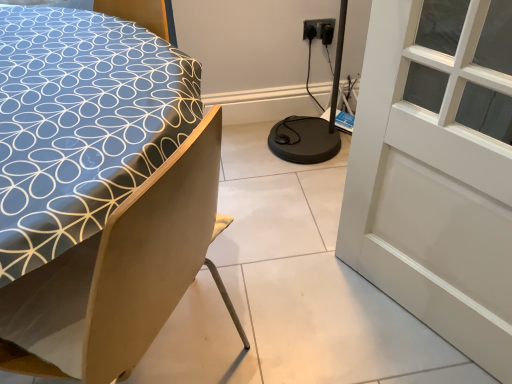
Image resolution: width=512 pixels, height=384 pixels. What are the coordinates of `black plastic electric outlet at upper right` in the screenshot? It's located at (319, 30).

What is the approximate height of blue fabric bed at left?

33.63 inches.

Identify the location of white glass window at upper right. (486, 112).

Is black plastic electric outlet at upper right situated inside white glass window at upper right or outside?

black plastic electric outlet at upper right exists outside the volume of white glass window at upper right.

Between black plastic electric outlet at upper right and white glass window at upper right, which one has smaller size?

With smaller size is black plastic electric outlet at upper right.

Which is more to the right, black plastic electric outlet at upper right or white glass window at upper right?

white glass window at upper right.

Do you think blue fabric bed at left is within white glass window at upper right, or outside of it?

blue fabric bed at left is located beyond the bounds of white glass window at upper right.

Identify the location of bed below the white glass window at upper right (from the image's perspective). (98, 194).

Between blue fabric bed at left and white glass window at upper right, which one is positioned behind?

white glass window at upper right is further from the camera.

Measure the distance from blue fabric bed at left to white glass window at upper right.

blue fabric bed at left and white glass window at upper right are 38.76 inches apart.

Can you confirm if blue fabric bed at left is positioned to the left of black plastic electric outlet at upper right?

Yes, blue fabric bed at left is to the left of black plastic electric outlet at upper right.

Would you consider blue fabric bed at left to be distant from black plastic electric outlet at upper right?

Absolutely, blue fabric bed at left is distant from black plastic electric outlet at upper right.

Would you say blue fabric bed at left is inside or outside black plastic electric outlet at upper right?

blue fabric bed at left is spatially situated outside black plastic electric outlet at upper right.

Who is shorter, blue fabric bed at left or black plastic electric outlet at upper right?

black plastic electric outlet at upper right.

From the picture: Is white glass window at upper right bigger than blue fabric bed at left?

Actually, white glass window at upper right might be smaller than blue fabric bed at left.

Consider the image. From the image's perspective, would you say white glass window at upper right is positioned over blue fabric bed at left?

Indeed, from the image's perspective, white glass window at upper right is shown above blue fabric bed at left.

Would you consider white glass window at upper right to be distant from blue fabric bed at left?

white glass window at upper right is near blue fabric bed at left, not far away.

Image resolution: width=512 pixels, height=384 pixels. I want to click on bed located below the black plastic electric outlet at upper right (from the image's perspective), so click(x=98, y=194).

Between point (320, 26) and point (115, 267), which one is positioned behind?

The point (320, 26) is behind.

Is the position of black plastic electric outlet at upper right less distant than that of blue fabric bed at left?

No, black plastic electric outlet at upper right is further to the viewer.

Does black plastic electric outlet at upper right turn towards blue fabric bed at left?

No, black plastic electric outlet at upper right is not facing towards blue fabric bed at left.

From a real-world perspective, who is located higher, white glass window at upper right or black plastic electric outlet at upper right?

white glass window at upper right, from a real-world perspective.

Looking at this image, considering the sizes of white glass window at upper right and black plastic electric outlet at upper right in the image, is white glass window at upper right taller or shorter than black plastic electric outlet at upper right?

In the image, white glass window at upper right appears to be taller than black plastic electric outlet at upper right.

The width and height of the screenshot is (512, 384). In order to click on window that is in front of the black plastic electric outlet at upper right in this screenshot , I will do `click(486, 112)`.

Considering their positions, is white glass window at upper right located in front of or behind black plastic electric outlet at upper right?

Clearly, white glass window at upper right is in front of black plastic electric outlet at upper right.

I want to click on electric outlet located on the left of white glass window at upper right, so click(x=319, y=30).

Locate an element on the screen. window lying behind the blue fabric bed at left is located at coordinates (486, 112).

Estimate the real-world distances between objects in this image. Which object is further from blue fabric bed at left, black plastic electric outlet at upper right or white glass window at upper right?

black plastic electric outlet at upper right.

Based on their spatial positions, is blue fabric bed at left or white glass window at upper right further from black plastic electric outlet at upper right?

blue fabric bed at left is further to black plastic electric outlet at upper right.

Looking at the image, which one is located closer to white glass window at upper right, black plastic electric outlet at upper right or blue fabric bed at left?

Based on the image, black plastic electric outlet at upper right appears to be nearer to white glass window at upper right.

Which object lies nearer to the anchor point black plastic electric outlet at upper right, white glass window at upper right or blue fabric bed at left?

Based on the image, white glass window at upper right appears to be nearer to black plastic electric outlet at upper right.

Looking at this image, considering their positions, is white glass window at upper right positioned further to blue fabric bed at left than black plastic electric outlet at upper right?

black plastic electric outlet at upper right.

When comparing their distances from white glass window at upper right, does blue fabric bed at left or black plastic electric outlet at upper right seem closer?

black plastic electric outlet at upper right is positioned closer to the anchor white glass window at upper right.

At what (x,y) coordinates should I click in order to perform the action: click on window positioned between blue fabric bed at left and black plastic electric outlet at upper right from near to far. Please return your answer as a coordinate pair (x, y). This screenshot has width=512, height=384. Looking at the image, I should click on (486, 112).